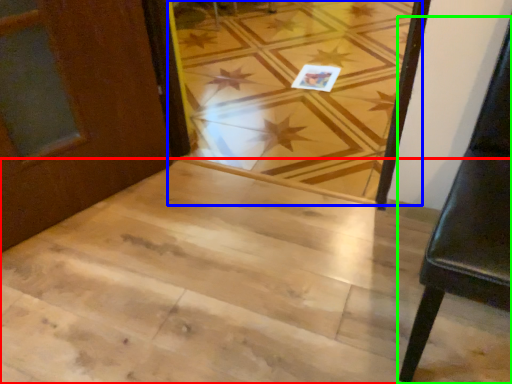
Question: Based on their relative distances, which object is farther from stairwell (highlighted by a red box)? Choose from plank (highlighted by a blue box) and furniture (highlighted by a green box).

Choices:
 (A) plank
 (B) furniture

Answer: (A)